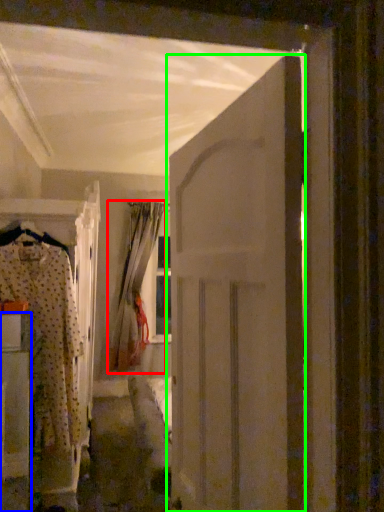
Question: Estimate the real-world distances between objects in this image. Which object is closer to curtain (highlighted by a red box), furniture (highlighted by a blue box) or door (highlighted by a green box)?

Choices:
 (A) furniture
 (B) door

Answer: (A)